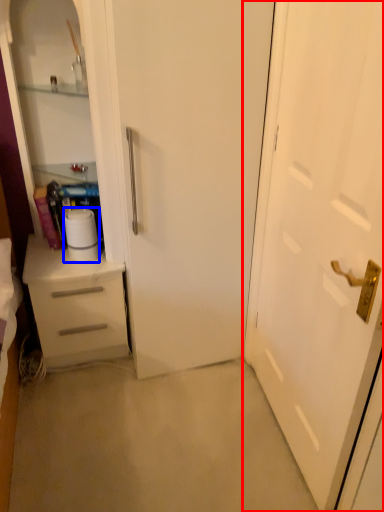
Question: Which object appears closest to the camera in this image, door (highlighted by a red box) or paper towel (highlighted by a blue box)?

Choices:
 (A) door
 (B) paper towel

Answer: (A)